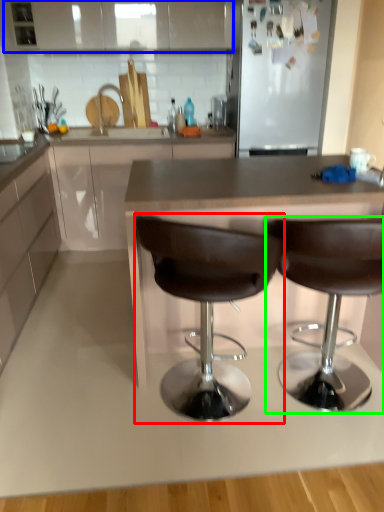
Question: Considering the real-world distances, which object is farthest from chair (highlighted by a red box)? cabinetry (highlighted by a blue box) or chair (highlighted by a green box)?

Choices:
 (A) cabinetry
 (B) chair

Answer: (A)